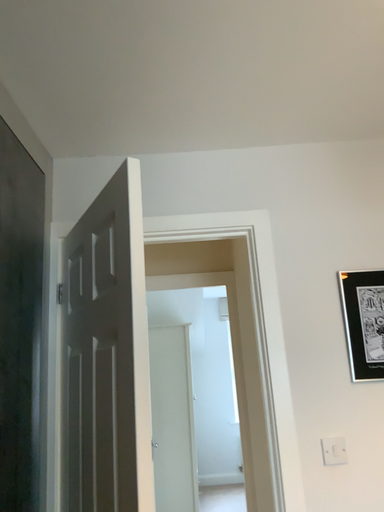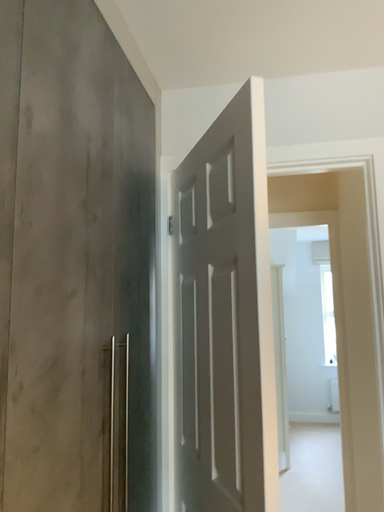
Question: Which way did the camera rotate in the video?

Choices:
 (A) rotated upward
 (B) rotated downward

Answer: (B)